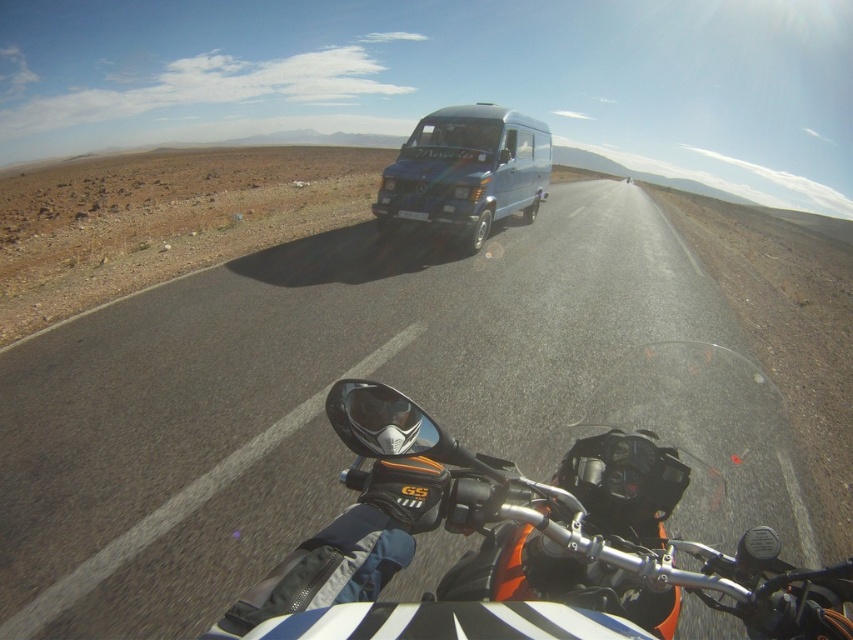
Does point (714, 518) lie in front of point (491, 120)?

That is True.

Where is `asphalt road at center`? asphalt road at center is located at coordinates pos(352,376).

What do you see at coordinates (352, 376) in the screenshot? This screenshot has height=640, width=853. I see `asphalt road at center` at bounding box center [352, 376].

Which of these two, asphalt road at center or orange matte motorcycle at center, stands taller?

asphalt road at center

Does point (703, 618) come behind point (645, 556)?

Yes, point (703, 618) is behind point (645, 556).

The width and height of the screenshot is (853, 640). I want to click on asphalt road at center, so click(x=352, y=376).

How far apart are orange matte motorcycle at center and blue metallic van at center?

orange matte motorcycle at center is 21.82 feet away from blue metallic van at center.

Is point (550, 525) farther from viewer compared to point (486, 140)?

That is False.

Does point (422, 477) come in front of point (398, 164)?

Yes, it is.

Locate an element on the screen. The image size is (853, 640). orange matte motorcycle at center is located at coordinates (521, 545).